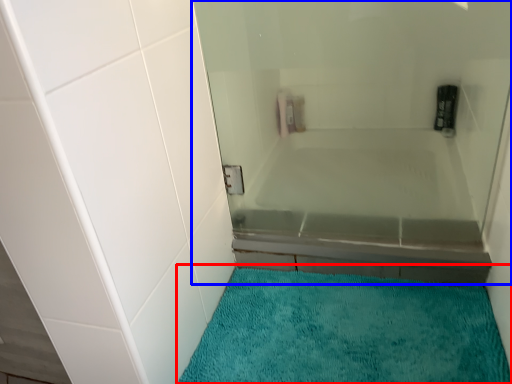
Question: Which point is further to the camera, bath mat (highlighted by a red box) or bath (highlighted by a blue box)?

Choices:
 (A) bath mat
 (B) bath

Answer: (B)